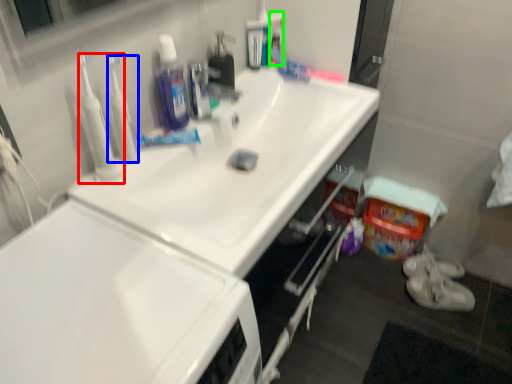
Question: Estimate the real-world distances between objects in this image. Which object is closer to cleanser (highlighted by a red box), cleanser (highlighted by a blue box) or cleaning products (highlighted by a green box)?

Choices:
 (A) cleanser
 (B) cleaning products

Answer: (A)